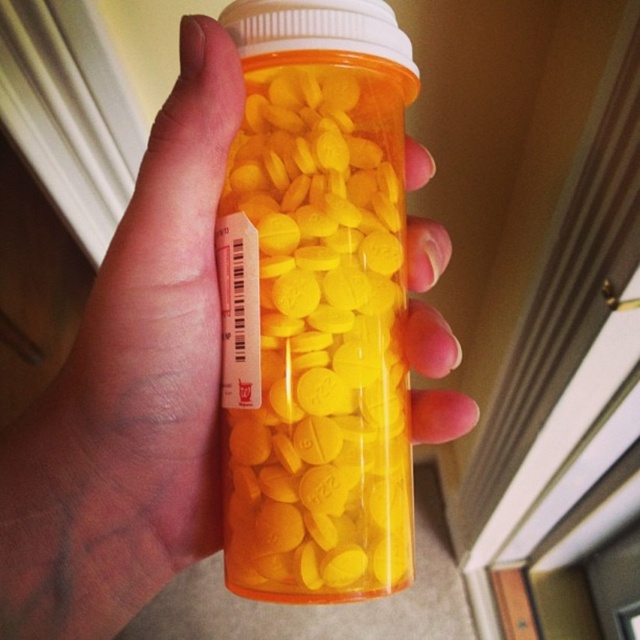
This screenshot has height=640, width=640. What are the coordinates of `translucent orange pill bottle at center` in the screenshot? It's located at pos(316,304).

Is point (374, 102) in front of point (109, 275)?

That is False.

You are a GUI agent. You are given a task and a screenshot of the screen. Output one action in this format:
    pyautogui.click(x=<x>, y=<y>)
    Task: Click on the translucent orange pill bottle at center
    This screenshot has width=640, height=640.
    Given the screenshot: What is the action you would take?
    pyautogui.click(x=316, y=304)

Identify the location of translucent orange pill bottle at center. This screenshot has height=640, width=640. (316, 304).